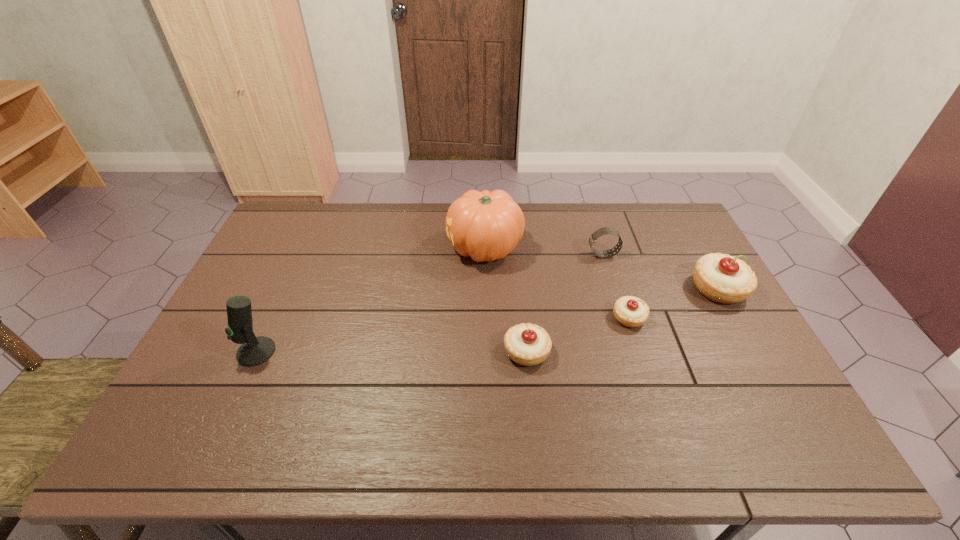
At what (x,y) coordinates should I click in order to perform the action: click on vacant area located on the left of the shortest pastry. Please return your answer as a coordinate pair (x, y). The width and height of the screenshot is (960, 540). Looking at the image, I should click on (584, 318).

Locate an element on the screen. free space located on the front of the tallest pastry is located at coordinates (780, 399).

What are the coordinates of `free point located on the face of the watch` in the screenshot? It's located at (552, 255).

Where is `free space located 0.190m on the face of the watch`? The image size is (960, 540). free space located 0.190m on the face of the watch is located at coordinates (531, 255).

I want to click on vacant point located 0.230m on the face of the watch, so click(x=518, y=255).

You are a GUI agent. You are given a task and a screenshot of the screen. Output one action in this format:
    pyautogui.click(x=<x>, y=<y>)
    Task: Click on the free region located 0.390m on the carved face of the pumpkin
    This screenshot has width=960, height=540.
    Given the screenshot: What is the action you would take?
    pyautogui.click(x=332, y=248)

Where is `blank space located 0.400m on the carved face of the pumpkin`? The height and width of the screenshot is (540, 960). blank space located 0.400m on the carved face of the pumpkin is located at coordinates (329, 248).

Identify the location of vacant point located on the carved face of the pumpkin. (341, 248).

Find the location of a particular element. The width and height of the screenshot is (960, 540). vacant area situated 0.280m on the back of the leftmost object is located at coordinates (x=294, y=269).

Identify the location of object located at the far edge. The width and height of the screenshot is (960, 540). (487, 226).